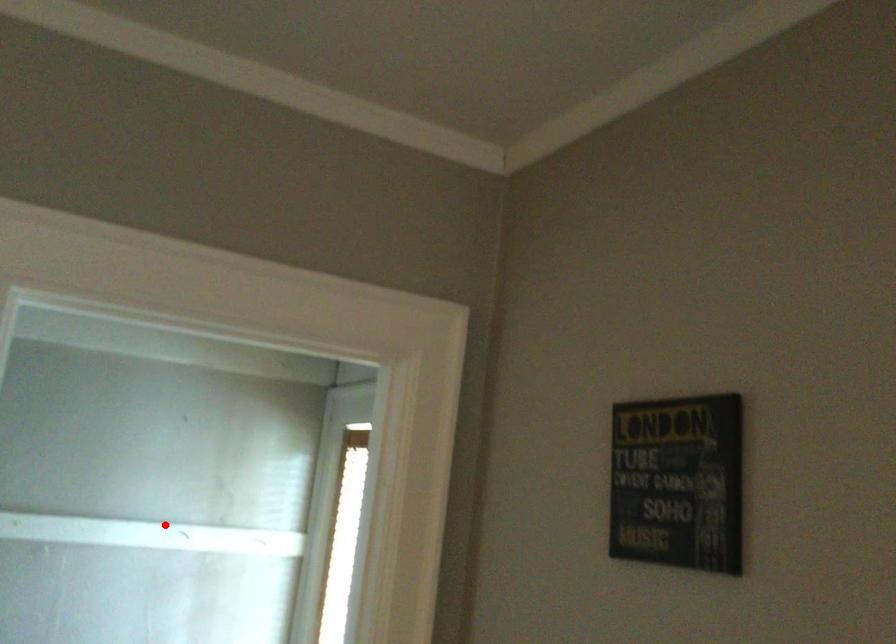
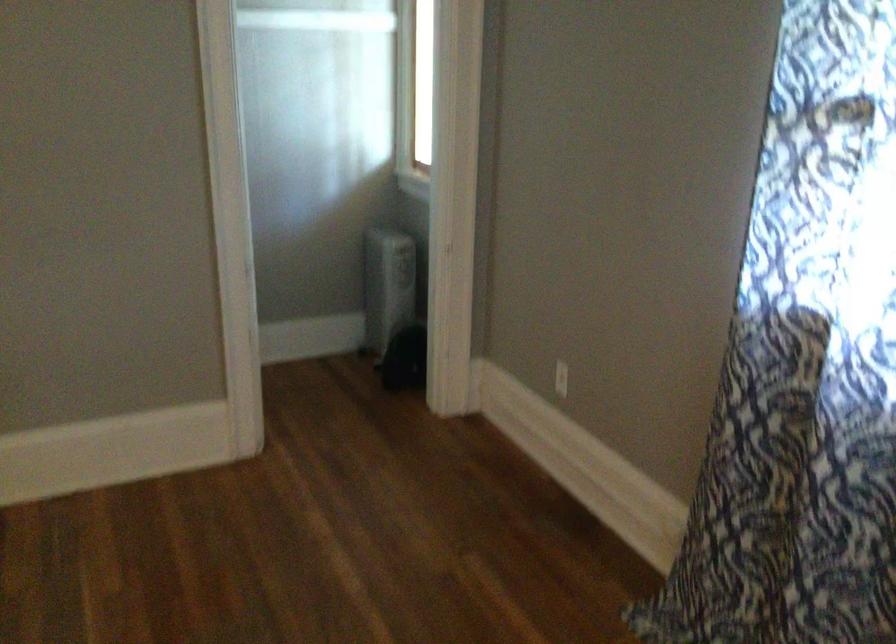
Question: I am providing you with two images of the same scene from different viewpoints. In image1, a red point is highlighted. Considering the same 3D point in image2, which of the following is correct?

Choices:
 (A) It is closer
 (B) It is farther

Answer: (B)